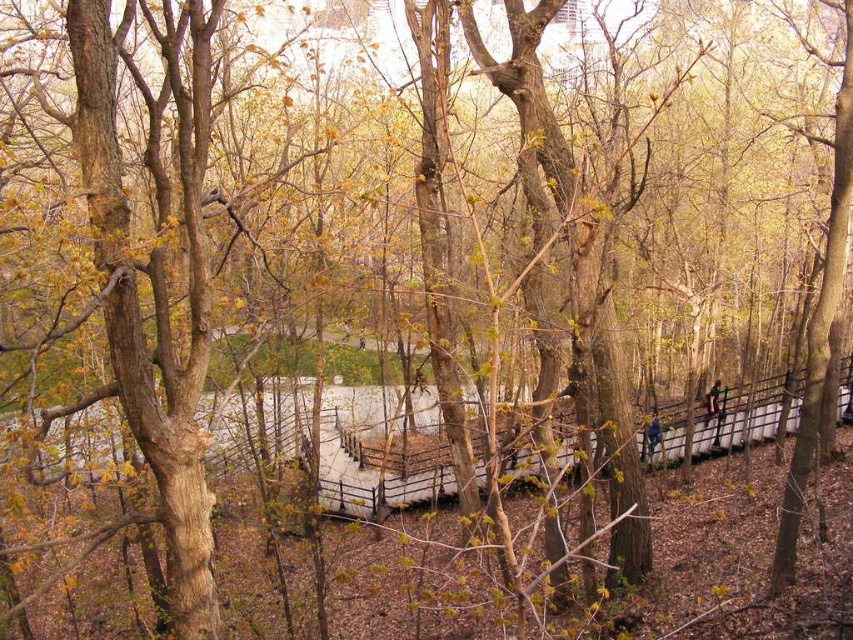
You are standing at the wooden bridge in the scene. You notice two points marked on the bridge. One is labeled as point [643,420] and the other as point [712,388]. If you are facing the direction of the bridge, which point is closer to you?

Point [643,420] is in front of point [712,388], so if you are facing the direction of the bridge, point [643,420] is closer to you.